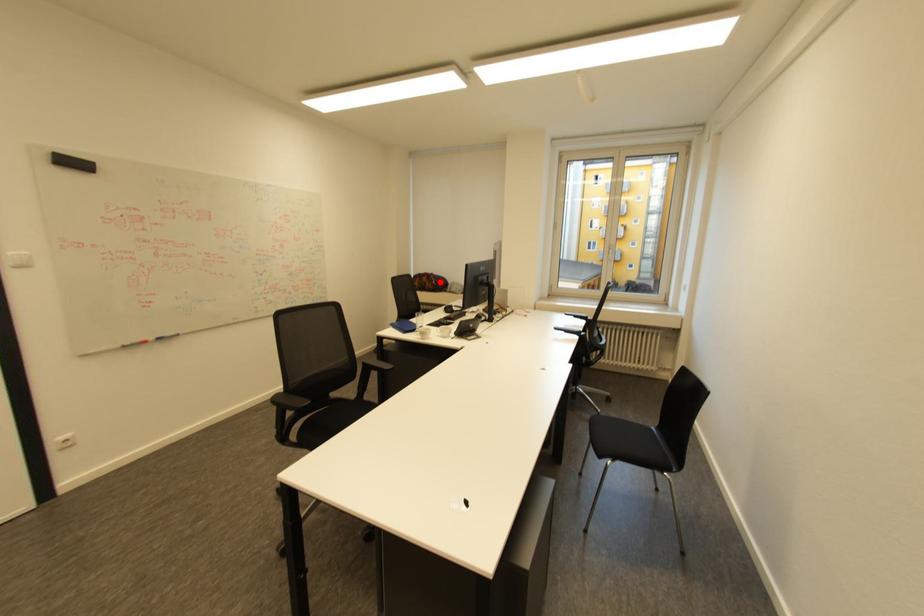
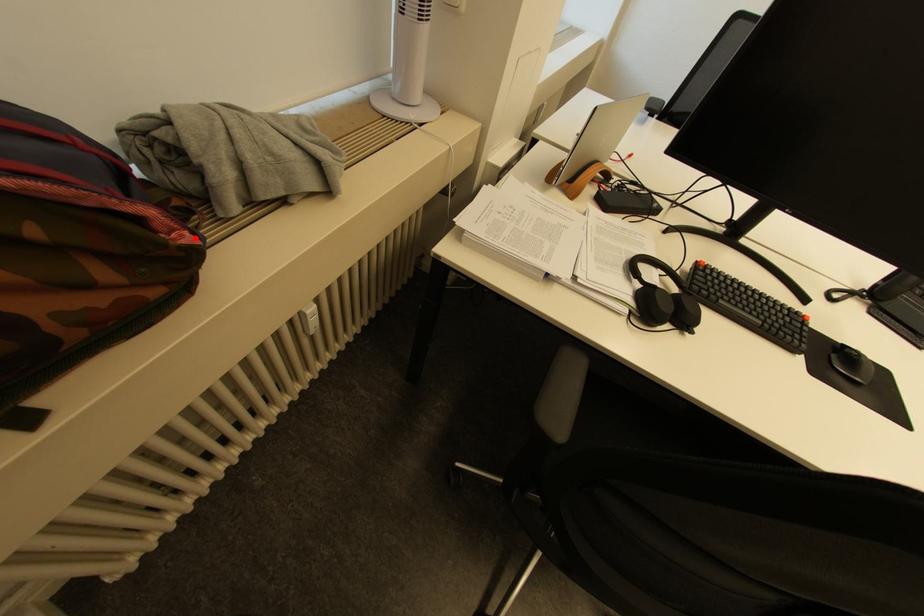
I am providing you with two images of the same scene from different viewpoints. A red point is marked on the first image and another point is marked on the second image. Are the points marked in image1 and image2 representing the same 3D position?

Yes